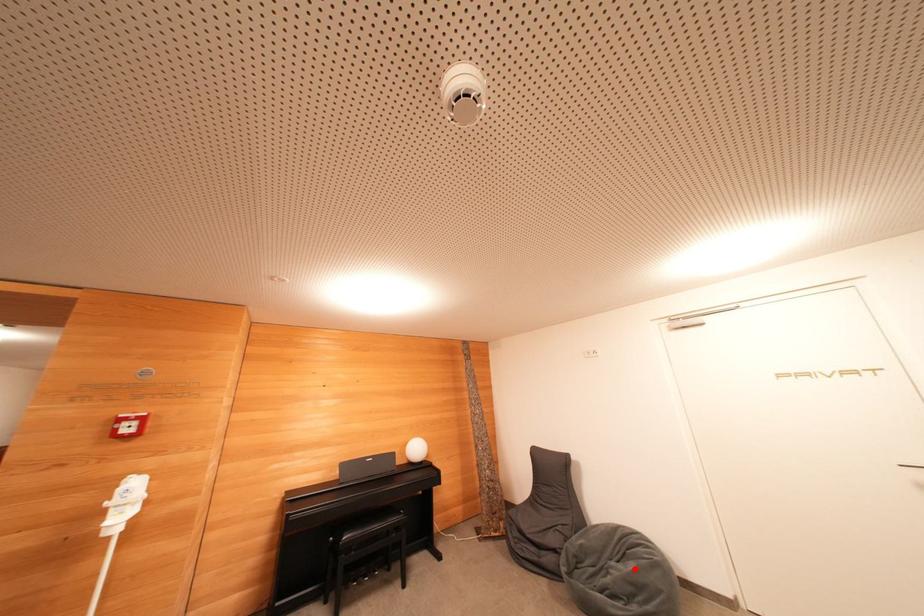
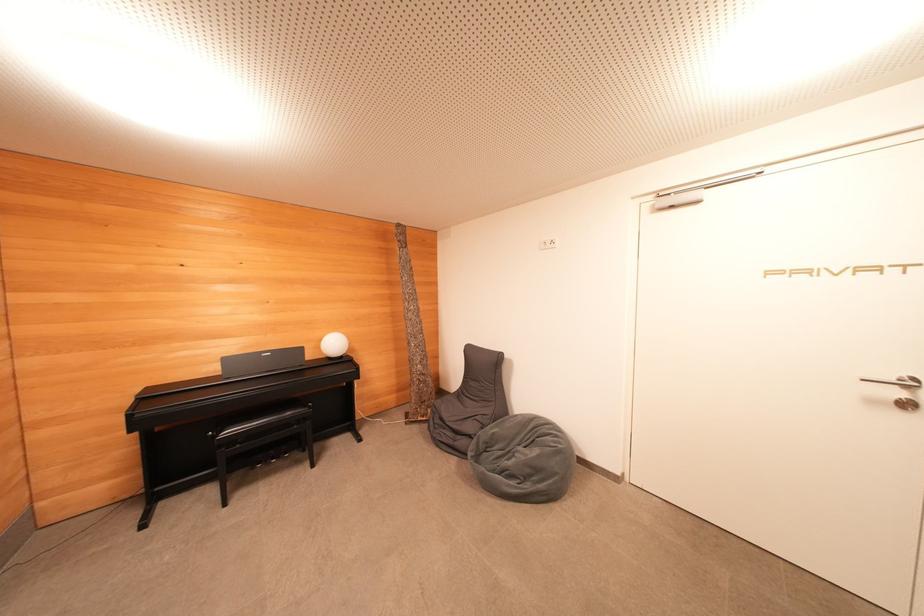
Where in the second image is the point corresponding to the highlighted location from the first image?

(540, 455)